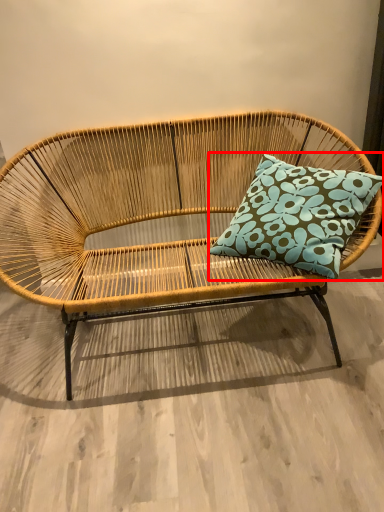
Question: In this image, where is pillow (annotated by the red box) located relative to studio couch?

Choices:
 (A) left
 (B) right

Answer: (B)